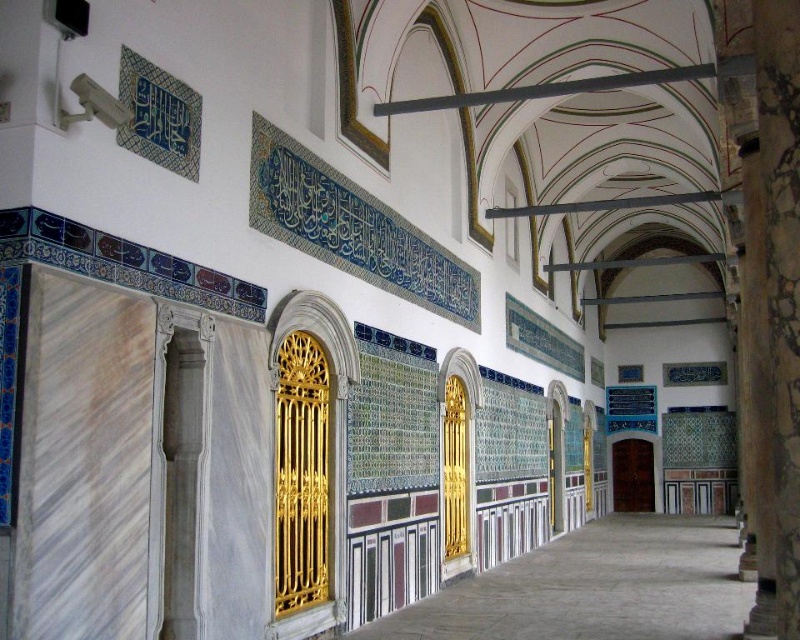
You are an architect visiting this grand historical building. You notice two doors in the center of the image. Which door is taller? The gold metallic door at center or the brown wooden door at center?

The gold metallic door at center is taller than the brown wooden door at center according to the description.

You are an architect visiting this historical building and need to choose between two doors to enter a restricted area. The gold metallic door at center and the brown wooden door at center are both options. Which door is larger and more likely to be the main entrance?

The gold metallic door at center is bigger than the brown wooden door at center, so it is more likely to be the main entrance.